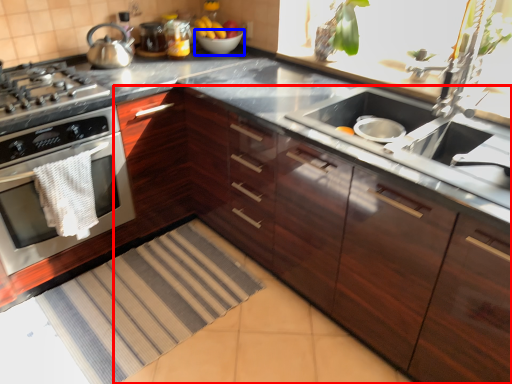
Question: Among these objects, which one is farthest to the camera, cabinetry (highlighted by a red box) or bowl (highlighted by a blue box)?

Choices:
 (A) cabinetry
 (B) bowl

Answer: (B)